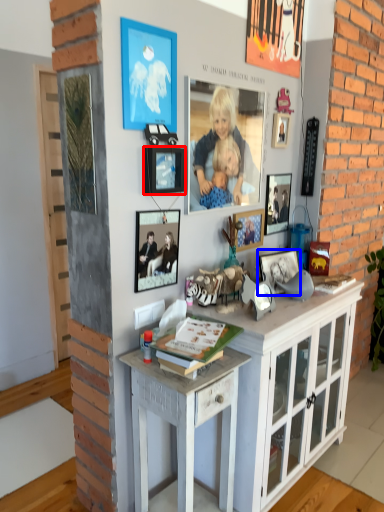
Question: Which object appears farthest to the camera in this image, picture frame (highlighted by a red box) or picture frame (highlighted by a blue box)?

Choices:
 (A) picture frame
 (B) picture frame

Answer: (B)